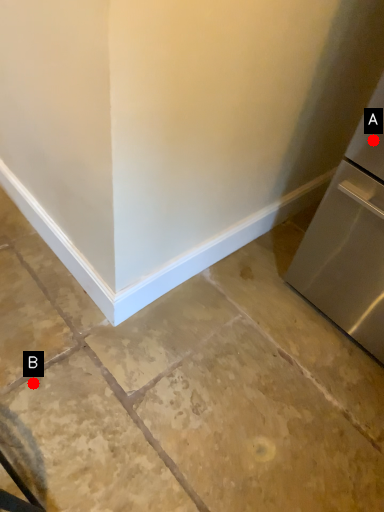
Question: Two points are circled on the image, labeled by A and B beside each circle. Which point appears closest to the camera in this image?

Choices:
 (A) A is closer
 (B) B is closer

Answer: (A)